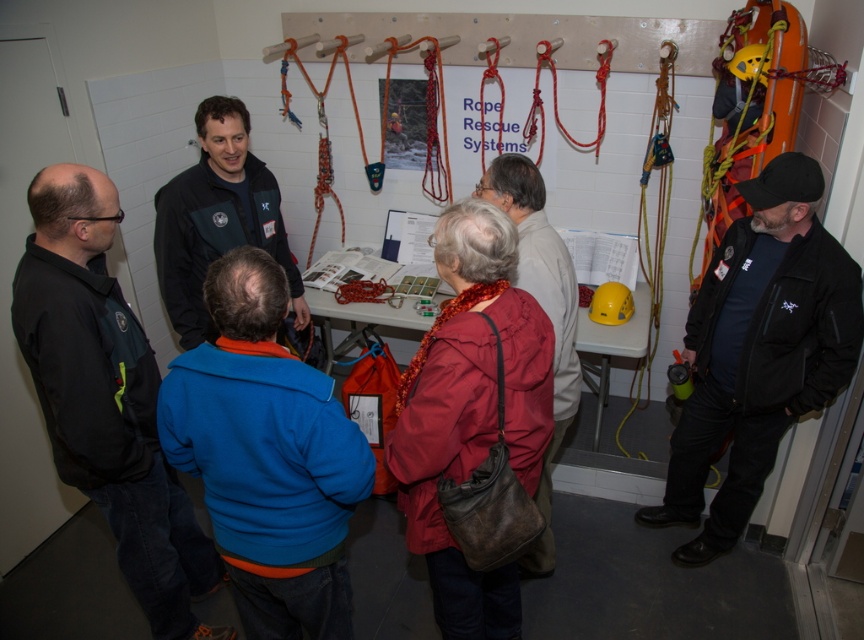
You are a participant in the rope rescue training and need to locate your belongings. You remember placing your blue fleece jacket at center and leather handbag at center on the metal table. Which item is closer to the left edge of the table?

The blue fleece jacket at center is to the left of the leather handbag at center, so the blue fleece jacket at center is closer to the left edge of the table.

You are a participant in the rope rescue training and need to reach the blue fleece jacket at center to grab a note from your pocket. Can you comfortably reach it without moving your feet?

The blue fleece jacket at center is 1.38 meters away from the viewer. Since the average arm reach is about 1 meter, you cannot comfortably reach it without moving closer.